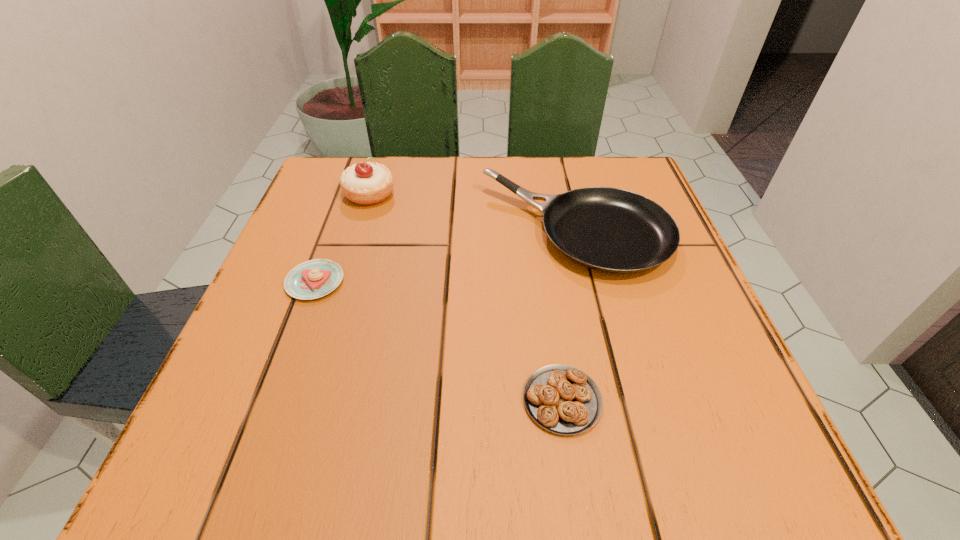
This screenshot has height=540, width=960. I want to click on the tallest object, so [368, 183].

Where is `the farthest pastry`? This screenshot has height=540, width=960. the farthest pastry is located at coordinates (368, 183).

Locate an element on the screen. the second tallest object is located at coordinates (612, 230).

You are a GUI agent. You are given a task and a screenshot of the screen. Output one action in this format:
    pyautogui.click(x=<x>, y=<y>)
    Task: Click on the second nearest pastry
    The image size is (960, 540).
    Given the screenshot: What is the action you would take?
    pyautogui.click(x=312, y=279)

At what (x,y) coordinates should I click in order to perform the action: click on the nearest pastry. Please return your answer as a coordinate pair (x, y). The width and height of the screenshot is (960, 540). Looking at the image, I should click on tap(562, 399).

The width and height of the screenshot is (960, 540). Find the location of `the nearest object`. the nearest object is located at coordinates (562, 399).

Identify the location of vacant area situated on the right of the tallest object. This screenshot has width=960, height=540. (560, 194).

The image size is (960, 540). I want to click on vacant space located 0.200m on the front of the second tallest object, so click(x=613, y=387).

Where is `blank space located 0.350m on the right of the second farthest pastry`? The width and height of the screenshot is (960, 540). blank space located 0.350m on the right of the second farthest pastry is located at coordinates (547, 281).

What are the coordinates of `free region located on the back of the nearest pastry` in the screenshot? It's located at (547, 300).